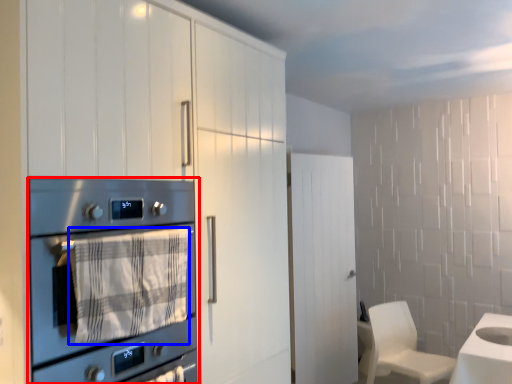
Question: Which object appears closest to the camera in this image, home appliance (highlighted by a red box) or blanket (highlighted by a blue box)?

Choices:
 (A) home appliance
 (B) blanket

Answer: (A)